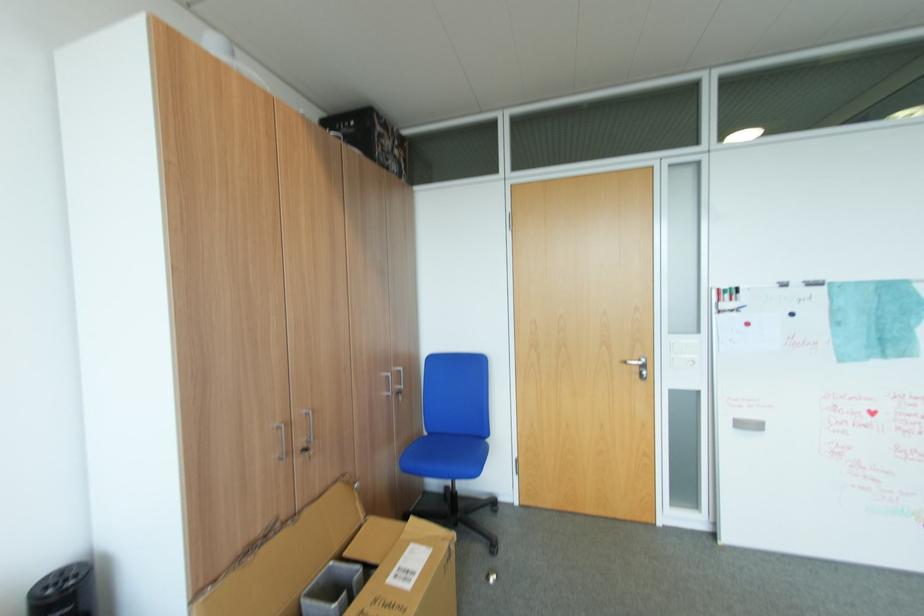
You are a GUI agent. You are given a task and a screenshot of the screen. Output one action in this format:
    pyautogui.click(x=<x>, y=<y>)
    Task: Click on the black box
    The image size is (924, 616).
    Given the screenshot: What is the action you would take?
    pyautogui.click(x=371, y=137)